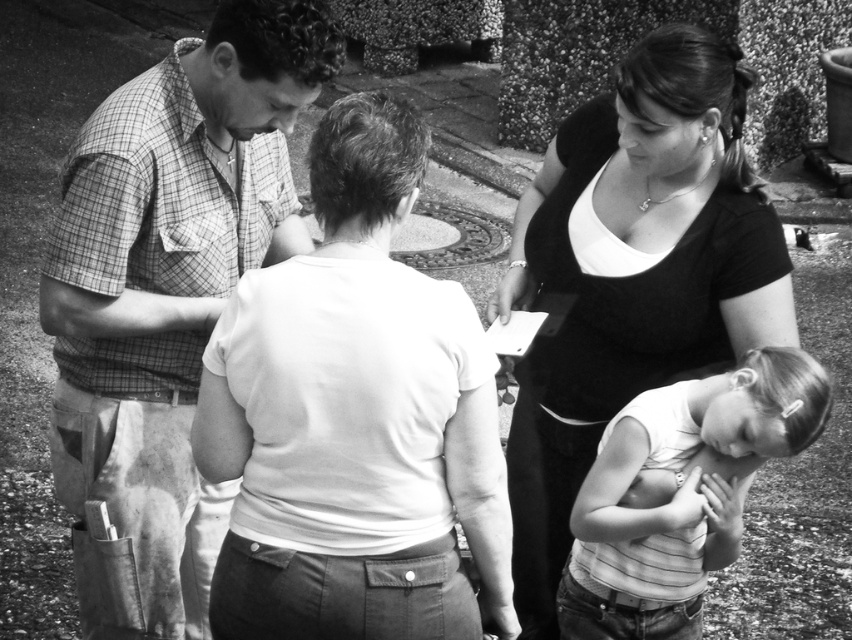
Question: Is checkered fabric shirt at left below white striped tank top at lower right?

Choices:
 (A) no
 (B) yes

Answer: (A)

Question: Considering the relative positions of checkered fabric shirt at left and matte black shirt at center in the image provided, where is checkered fabric shirt at left located with respect to matte black shirt at center?

Choices:
 (A) above
 (B) below

Answer: (A)

Question: Which object is closer to the camera taking this photo?

Choices:
 (A) white striped tank top at lower right
 (B) matte black shirt at center
 (C) checkered fabric shirt at left

Answer: (A)

Question: Which of the following is the farthest from the observer?

Choices:
 (A) click(x=631, y=432)
 (B) click(x=675, y=88)

Answer: (A)

Question: Does checkered fabric shirt at left have a larger size compared to matte black shirt at center?

Choices:
 (A) yes
 (B) no

Answer: (B)

Question: Among these objects, which one is farthest from the camera?

Choices:
 (A) white striped tank top at lower right
 (B) checkered fabric shirt at left
 (C) matte black shirt at center

Answer: (C)